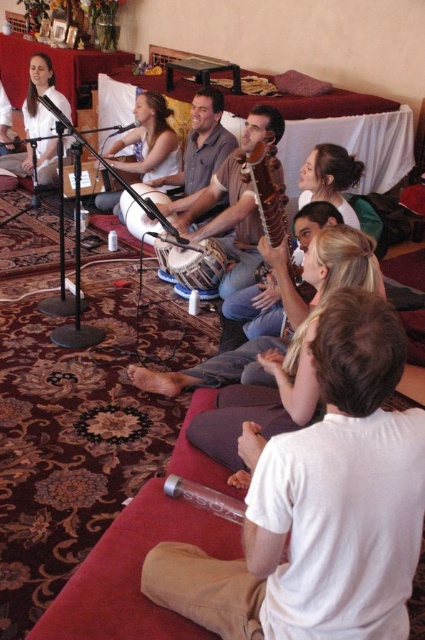
Looking at this image, between wooden guitar at center and matte brown tabla at center, which one has less height?

matte brown tabla at center

Who is positioned more to the left, wooden guitar at center or matte brown tabla at center?

→ From the viewer's perspective, matte brown tabla at center appears more on the left side.

Find the location of a particular element. The image size is (425, 640). wooden guitar at center is located at coordinates (265, 189).

This screenshot has height=640, width=425. What are the coordinates of `wooden guitar at center` in the screenshot? It's located at (265, 189).

Does matte white shirt at center have a greater width compared to matte white shirt at upper left?

No.

The width and height of the screenshot is (425, 640). What are the coordinates of `matte white shirt at center` in the screenshot? It's located at (149, 140).

Between matte white shirt at center and wooden drum at center, which one is positioned higher?

Positioned higher is matte white shirt at center.

Between matte white shirt at center and wooden drum at center, which one appears on the left side from the viewer's perspective?

From the viewer's perspective, matte white shirt at center appears more on the left side.

Between point (149, 125) and point (156, 256), which one is positioned in front?

Point (156, 256)

You are a GUI agent. You are given a task and a screenshot of the screen. Output one action in this format:
    pyautogui.click(x=<x>, y=<y>)
    Task: Click on the matte white shirt at center
    
    Given the screenshot: What is the action you would take?
    pyautogui.click(x=149, y=140)